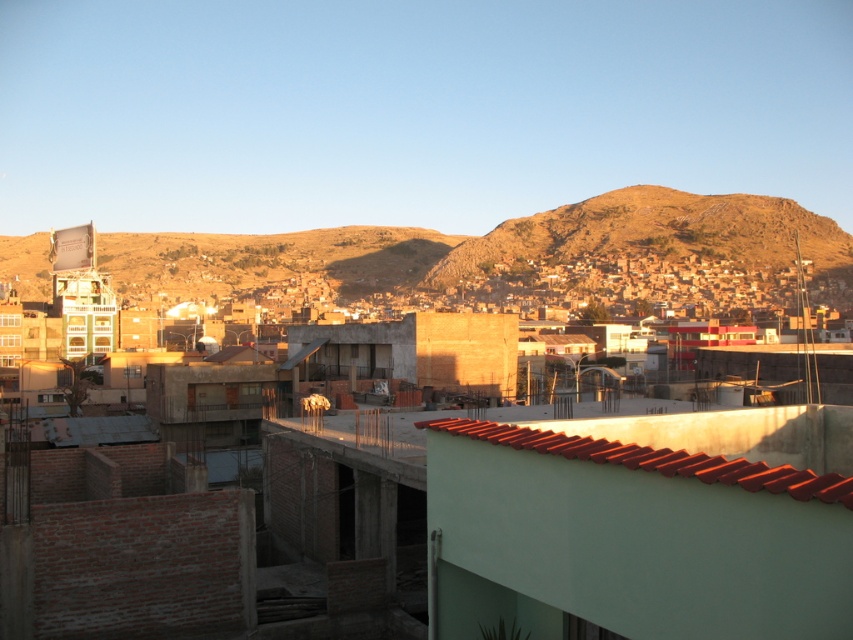
Does point (495, 228) lie behind point (614, 440)?

Yes, point (495, 228) is farther from viewer.

Can you confirm if brown rocky hillside at upper center is positioned to the left of red clay tiles at center?

Incorrect, brown rocky hillside at upper center is not on the left side of red clay tiles at center.

Is point (763, 246) closer to camera compared to point (498, 433)?

No, it is not.

Find the location of a particular element. This screenshot has width=853, height=640. brown rocky hillside at upper center is located at coordinates (657, 232).